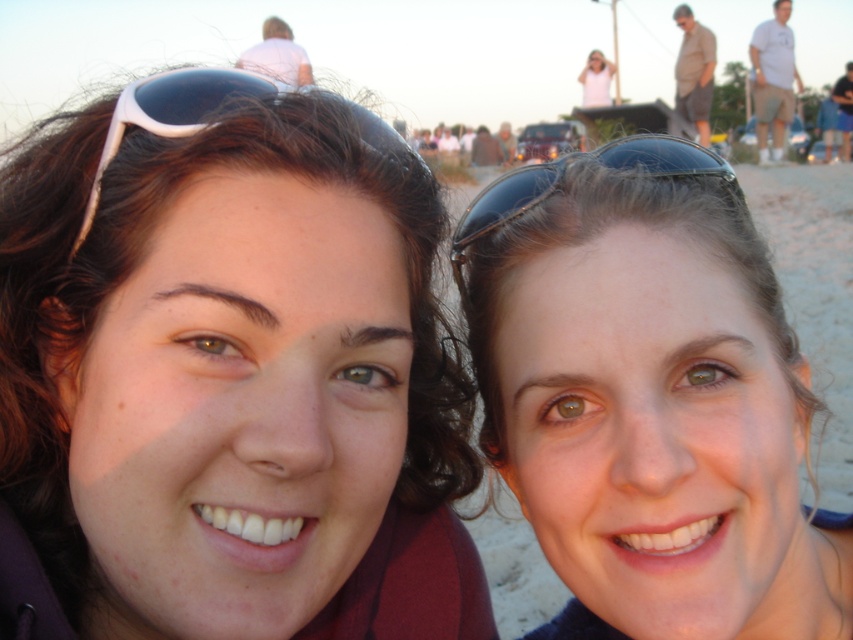
Does black matte sunglasses at upper center have a larger size compared to white cotton shirt at upper right?

No, black matte sunglasses at upper center is not bigger than white cotton shirt at upper right.

Is point (521, 170) closer to viewer compared to point (761, 51)?

Yes, point (521, 170) is in front of point (761, 51).

Describe the element at coordinates (564, 173) in the screenshot. I see `black matte sunglasses at upper center` at that location.

The height and width of the screenshot is (640, 853). In order to click on black matte sunglasses at upper center in this screenshot , I will do `click(564, 173)`.

Does matte black sunglasses at upper center have a lesser height compared to black matte sunglasses at upper center?

Incorrect, matte black sunglasses at upper center's height does not fall short of black matte sunglasses at upper center's.

Measure the distance between matte black sunglasses at upper center and camera.

matte black sunglasses at upper center is 27.74 inches away from camera.

This screenshot has height=640, width=853. Identify the location of matte black sunglasses at upper center. (648, 397).

Between matte black sunglasses at upper left and gray fabric shirt at upper right, which one is positioned higher?

gray fabric shirt at upper right

Does matte black sunglasses at upper left have a larger size compared to gray fabric shirt at upper right?

Incorrect, matte black sunglasses at upper left is not larger than gray fabric shirt at upper right.

Which is behind, point (329, 221) or point (711, 49)?

Positioned behind is point (711, 49).

Locate an element on the screen. This screenshot has height=640, width=853. matte black sunglasses at upper left is located at coordinates (229, 376).